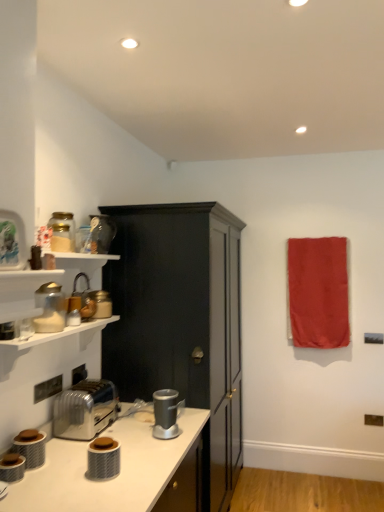
Locate an element on the screen. The height and width of the screenshot is (512, 384). metallic silver toaster at lower left, positioned as the 1th appliance in front-to-back order is located at coordinates (12, 467).

Image resolution: width=384 pixels, height=512 pixels. Describe the element at coordinates (12, 467) in the screenshot. I see `metallic silver toaster at lower left, the 7th appliance from the top` at that location.

This screenshot has height=512, width=384. What do you see at coordinates (318, 292) in the screenshot? I see `red fabric towel at upper right` at bounding box center [318, 292].

Where is `metallic silver kettle at left, the 6th appliance when ordered from bottom to top`? The image size is (384, 512). metallic silver kettle at left, the 6th appliance when ordered from bottom to top is located at coordinates (82, 298).

Image resolution: width=384 pixels, height=512 pixels. Describe the element at coordinates (82, 298) in the screenshot. I see `metallic silver kettle at left, the 6th appliance when ordered from bottom to top` at that location.

Measure the distance between matte glass jar at upper left, the fourth appliance from the top, and camera.

The distance of matte glass jar at upper left, the fourth appliance from the top, from camera is 7.38 feet.

Locate an element on the screen. The height and width of the screenshot is (512, 384). matte white blender at left, the 4th appliance when ordered from front to back is located at coordinates (50, 308).

What do you see at coordinates (181, 322) in the screenshot? I see `matte black cabinet at center` at bounding box center [181, 322].

Where is `metallic silver toaster at lower left, which is the seventh appliance in back-to-front order`? This screenshot has width=384, height=512. metallic silver toaster at lower left, which is the seventh appliance in back-to-front order is located at coordinates (12, 467).

In the scene shown: Relative to metallic silver kettle at left, the 2th appliance from the top, is satin silver coffee machine at lower center in front or behind?

In the image, satin silver coffee machine at lower center appears in front of metallic silver kettle at left, the 2th appliance from the top.

Can you confirm if satin silver coffee machine at lower center is smaller than metallic silver kettle at left, the 6th appliance when ordered from bottom to top?

Yes.

Consider the image. Between satin silver coffee machine at lower center and metallic silver kettle at left, the 6th appliance when ordered from bottom to top, which one appears on the left side from the viewer's perspective?

metallic silver kettle at left, the 6th appliance when ordered from bottom to top.

From a real-world perspective, who is located higher, metallic silver toaster at lower left, the 1th appliance ordered from the bottom, or matte glass jar at upper left, which is the 7th appliance in front-to-back order?

matte glass jar at upper left, which is the 7th appliance in front-to-back order.

Consider the image. From the image's perspective, is metallic silver toaster at lower left, which is the seventh appliance in back-to-front order, located above or below matte glass jar at upper left, which is the 7th appliance in front-to-back order?

metallic silver toaster at lower left, which is the seventh appliance in back-to-front order, is situated lower than matte glass jar at upper left, which is the 7th appliance in front-to-back order, in the image.

Considering the positions of objects metallic silver toaster at lower left, positioned as the 1th appliance in front-to-back order, and matte glass jar at upper left, the 1th appliance viewed from the back, in the image provided, who is in front, metallic silver toaster at lower left, positioned as the 1th appliance in front-to-back order, or matte glass jar at upper left, the 1th appliance viewed from the back,?

metallic silver toaster at lower left, positioned as the 1th appliance in front-to-back order.

Considering the relative sizes of metallic silver toaster at lower left, positioned as the 1th appliance in front-to-back order, and matte glass jar at upper left, the 1th appliance viewed from the back, in the image provided, is metallic silver toaster at lower left, positioned as the 1th appliance in front-to-back order, bigger than matte glass jar at upper left, the 1th appliance viewed from the back,?

Incorrect, metallic silver toaster at lower left, positioned as the 1th appliance in front-to-back order, is not larger than matte glass jar at upper left, the 1th appliance viewed from the back.

From the image's perspective, is metallic silver toaster at lower left, the 1th appliance ordered from the bottom, on top of matte glass jar at upper left, which is the 1th appliance from top to bottom?

No, from the image's perspective, metallic silver toaster at lower left, the 1th appliance ordered from the bottom, is not above matte glass jar at upper left, which is the 1th appliance from top to bottom.

Considering the relative positions of metallic silver toaster at lower left, the 7th appliance from the top, and matte glass jar at upper left, which is the 2th appliance from back to front, in the image provided, is metallic silver toaster at lower left, the 7th appliance from the top, to the right of matte glass jar at upper left, which is the 2th appliance from back to front, from the viewer's perspective?

In fact, metallic silver toaster at lower left, the 7th appliance from the top, is to the left of matte glass jar at upper left, which is the 2th appliance from back to front.

Which of these two, metallic silver toaster at lower left, positioned as the 1th appliance in front-to-back order, or matte glass jar at upper left, which is the 2th appliance from back to front, is smaller?

With smaller size is metallic silver toaster at lower left, positioned as the 1th appliance in front-to-back order.

From a real-world perspective, which appliance is the 6th one above the metallic silver toaster at lower left, positioned as the 1th appliance in front-to-back order? Please provide its 2D coordinates.

[(101, 233)]

From the image's perspective, between silver metallic toaster at lower left and metallic silver toaster at lower left, which is the second appliance in bottom-to-top order, which one is located above?

silver metallic toaster at lower left appears higher in the image.

Considering the positions of point (89, 400) and point (35, 456), is point (89, 400) closer or farther from the camera than point (35, 456)?

Point (89, 400) is farther from the camera than point (35, 456).

Is silver metallic toaster at lower left facing away from metallic silver toaster at lower left, acting as the 6th appliance starting from the top?

silver metallic toaster at lower left is not turned away from metallic silver toaster at lower left, acting as the 6th appliance starting from the top.

You are a GUI agent. You are given a task and a screenshot of the screen. Output one action in this format:
    pyautogui.click(x=<x>, y=<y>)
    Task: Click on the beach towel on the right of the satin silver coffee machine at lower center
    This screenshot has height=512, width=384.
    Given the screenshot: What is the action you would take?
    pyautogui.click(x=318, y=292)

What's the angular difference between satin silver coffee machine at lower center and red fabric towel at upper right's facing directions?

There is a 48.3-degree angle between the facing directions of satin silver coffee machine at lower center and red fabric towel at upper right.

Is satin silver coffee machine at lower center not close to red fabric towel at upper right?

satin silver coffee machine at lower center is positioned a significant distance from red fabric towel at upper right.

Does satin silver coffee machine at lower center lie in front of red fabric towel at upper right?

Yes, it is.

The image size is (384, 512). Find the location of `beach towel above the metallic silver toaster at lower left, the fifth appliance viewed from the back (from a real-world perspective)`. beach towel above the metallic silver toaster at lower left, the fifth appliance viewed from the back (from a real-world perspective) is located at coordinates (318, 292).

In terms of width, does metallic silver toaster at lower left, arranged as the 3th appliance when viewed from the front, look wider or thinner when compared to red fabric towel at upper right?

metallic silver toaster at lower left, arranged as the 3th appliance when viewed from the front, is wider than red fabric towel at upper right.

Considering the points (24, 454) and (312, 327), which point is in front, point (24, 454) or point (312, 327)?

The point (24, 454) is more forward.

From the picture: Are metallic silver toaster at lower left, arranged as the 3th appliance when viewed from the front, and red fabric towel at upper right far apart?

metallic silver toaster at lower left, arranged as the 3th appliance when viewed from the front, is positioned a significant distance from red fabric towel at upper right.

From the image's perspective, is matte black canister at lower center, placed as the sixth appliance when sorted from back to front, located above or below metallic silver toaster at lower left, the 7th appliance from the top?

matte black canister at lower center, placed as the sixth appliance when sorted from back to front, is above metallic silver toaster at lower left, the 7th appliance from the top.

Based on the photo, who is taller, matte black canister at lower center, arranged as the fifth appliance when viewed from the top, or metallic silver toaster at lower left, the 7th appliance from the top?

Standing taller between the two is matte black canister at lower center, arranged as the fifth appliance when viewed from the top.

In the scene shown: How many degrees apart are the facing directions of matte black canister at lower center, placed as the third appliance when sorted from bottom to top, and metallic silver toaster at lower left, the 1th appliance ordered from the bottom?

matte black canister at lower center, placed as the third appliance when sorted from bottom to top, and metallic silver toaster at lower left, the 1th appliance ordered from the bottom, are facing 1.57 degrees away from each other.

Find the location of a particular element. coffee machine beneath the metallic silver kettle at left, the 6th appliance when ordered from bottom to top (from a real-world perspective) is located at coordinates (166, 413).

Locate an element on the screen. Image resolution: width=384 pixels, height=512 pixels. the 3rd appliance positioned above the metallic silver toaster at lower left, the 1th appliance ordered from the bottom (from a real-world perspective) is located at coordinates (101, 304).

Estimate the real-world distances between objects in this image. Which object is further from matte white blender at left, the 4th appliance when ordered from front to back, metallic silver kettle at left, the 2th appliance from the top, or red fabric towel at upper right?

red fabric towel at upper right is further to matte white blender at left, the 4th appliance when ordered from front to back.

From the image, which object appears to be farther from silver metallic toaster at lower left, matte black canister at lower center, arranged as the fifth appliance when viewed from the top, or satin silver coffee machine at lower center?

matte black canister at lower center, arranged as the fifth appliance when viewed from the top, is positioned further to the anchor silver metallic toaster at lower left.

Which object lies nearer to the anchor point matte white blender at left, the 4th appliance when ordered from front to back, red fabric towel at upper right or silver metallic toaster at lower left?

silver metallic toaster at lower left.

Consider the image. Estimate the real-world distances between objects in this image. Which object is further from matte white blender at left, the 4th appliance when ordered from front to back, matte black cabinet at center or matte black canister at lower center, arranged as the fifth appliance when viewed from the top?

matte black cabinet at center is positioned further to the anchor matte white blender at left, the 4th appliance when ordered from front to back.

Estimate the real-world distances between objects in this image. Which object is closer to silver metallic toaster at lower left, matte glass jar at upper left, which is the 7th appliance in front-to-back order, or satin silver coffee machine at lower center?

satin silver coffee machine at lower center.

Which object lies further to the anchor point matte black cabinet at center, matte black canister at lower center, placed as the third appliance when sorted from bottom to top, or silver metallic toaster at lower left?

matte black canister at lower center, placed as the third appliance when sorted from bottom to top.

From the image, which object appears to be farther from metallic silver toaster at lower left, arranged as the 3th appliance when viewed from the front, matte glass jar at upper left, the fourth appliance positioned from the bottom, or metallic silver kettle at left, marked as the fifth appliance in a front-to-back arrangement?

matte glass jar at upper left, the fourth appliance positioned from the bottom.

From the image, which object appears to be farther from metallic silver kettle at left, positioned as the third appliance in back-to-front order, satin silver coffee machine at lower center or matte white blender at left, the 4th appliance when ordered from front to back?

satin silver coffee machine at lower center is positioned further to the anchor metallic silver kettle at left, positioned as the third appliance in back-to-front order.

Locate an element on the screen. The width and height of the screenshot is (384, 512). toaster between matte white blender at left, the fourth appliance viewed from the back, and red fabric towel at upper right is located at coordinates (85, 409).

Locate an element on the screen. The width and height of the screenshot is (384, 512). toaster between metallic silver toaster at lower left, the fifth appliance viewed from the back, and matte black cabinet at center from left to right is located at coordinates (85, 409).

This screenshot has width=384, height=512. I want to click on cabinetry that lies between matte glass jar at upper left, acting as the 7th appliance starting from the bottom, and metallic silver toaster at lower left, the 7th appliance from the top, from top to bottom, so click(x=181, y=322).

Find the location of a particular element. The height and width of the screenshot is (512, 384). cabinetry between matte glass jar at upper left, which is the 1th appliance from top to bottom, and silver metallic toaster at lower left, in the vertical direction is located at coordinates (181, 322).